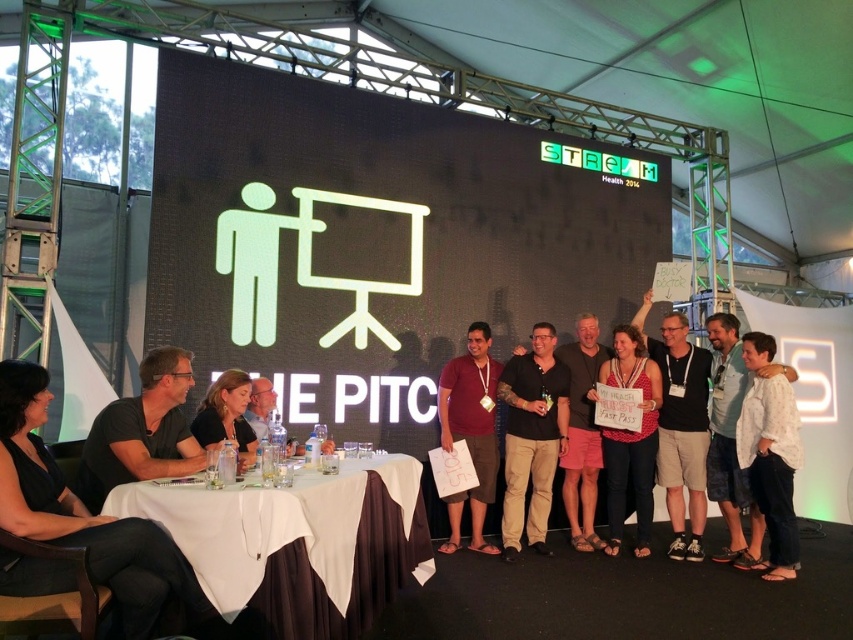
Does black cotton shirt at center have a greater width compared to matte black t-shirt at center?

Yes, black cotton shirt at center is wider than matte black t-shirt at center.

Which of these two, black cotton shirt at center or matte black t-shirt at center, stands taller?

Standing taller between the two is matte black t-shirt at center.

Is point (540, 440) positioned before point (677, 332)?

Yes.

Where is `black cotton shirt at center`? Image resolution: width=853 pixels, height=640 pixels. black cotton shirt at center is located at coordinates (532, 436).

Between white cloth-covered table at lower left and black cotton shirt at center, which one appears on the right side from the viewer's perspective?

black cotton shirt at center is more to the right.

Who is more distant from viewer, (372, 483) or (543, 474)?

Point (543, 474)

Locate an element on the screen. This screenshot has width=853, height=640. white cloth-covered table at lower left is located at coordinates (299, 541).

Identify the location of black cotton shirt at center. (532, 436).

Between black cotton shirt at center and denim shorts at center, which one has less height?

Standing shorter between the two is black cotton shirt at center.

Is point (550, 445) positioned before point (641, 476)?

No, (550, 445) is behind (641, 476).

At what (x,y) coordinates should I click in order to perform the action: click on black cotton shirt at center. Please return your answer as a coordinate pair (x, y). This screenshot has width=853, height=640. Looking at the image, I should click on (532, 436).